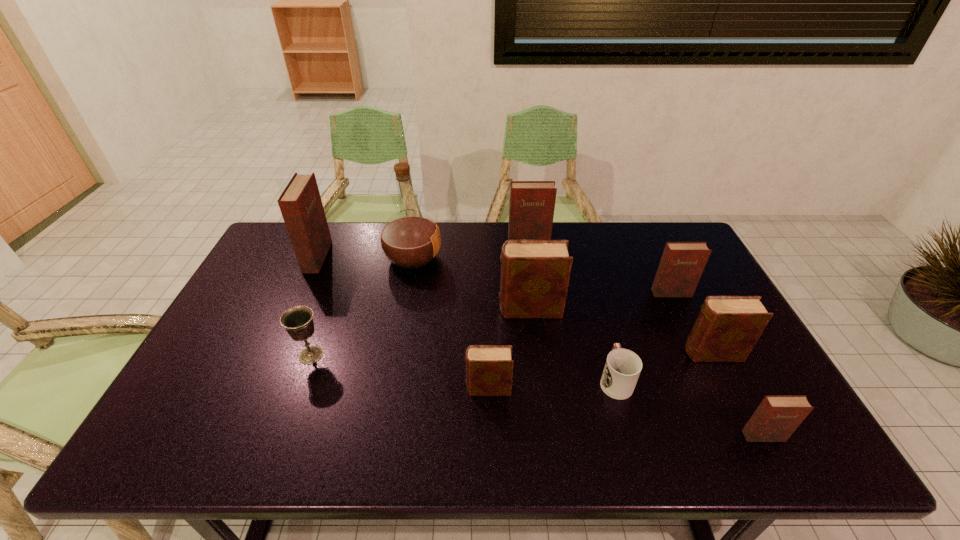
The image size is (960, 540). Identify the location of object that is positioned at the near right corner. (776, 418).

Where is `free space at the far edge of the desktop`? free space at the far edge of the desktop is located at coordinates (490, 243).

This screenshot has width=960, height=540. I want to click on vacant area at the near edge, so click(408, 435).

Where is `vacant space at the left edge of the desktop`? Image resolution: width=960 pixels, height=540 pixels. vacant space at the left edge of the desktop is located at coordinates (224, 339).

The image size is (960, 540). Identify the location of vacant space at the far left corner of the desktop. (287, 248).

At what (x,y) coordinates should I click in order to perform the action: click on free space at the near right corner of the desktop. Please return your answer as a coordinate pair (x, y). The width and height of the screenshot is (960, 540). Looking at the image, I should click on (766, 449).

This screenshot has width=960, height=540. In order to click on vacant area that lies between the liquor and the nearest brown diary in this screenshot , I will do click(x=450, y=323).

Locate an element on the screen. This screenshot has width=960, height=540. vacant region between the pink liquor and the cup is located at coordinates (514, 319).

In order to click on free space that is in between the shortest object and the third farthest reddish-brown diary in this screenshot , I will do `click(643, 336)`.

At what (x,y) coordinates should I click in order to perform the action: click on vacant point located between the smallest brown diary and the red cup. Please return your answer as a coordinate pair (x, y). The height and width of the screenshot is (540, 960). Looking at the image, I should click on (552, 384).